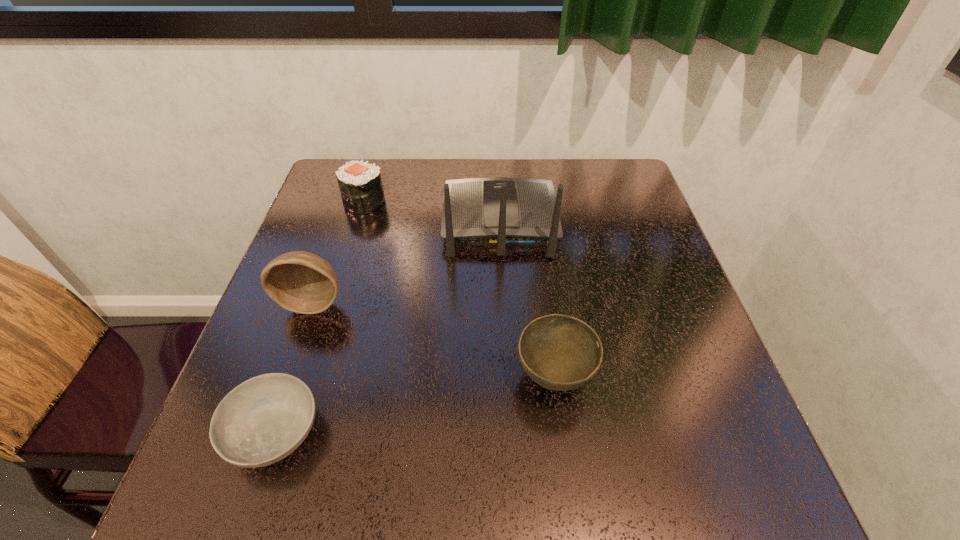
The width and height of the screenshot is (960, 540). I want to click on the tallest object, so click(498, 211).

The image size is (960, 540). Find the location of `the second tallest object`. the second tallest object is located at coordinates (302, 282).

Locate an element on the screen. The image size is (960, 540). the tallest bowl is located at coordinates (302, 282).

The width and height of the screenshot is (960, 540). What are the coordinates of `sushi` in the screenshot? It's located at (361, 187).

The height and width of the screenshot is (540, 960). In order to click on the rightmost bowl in this screenshot , I will do `click(559, 352)`.

Locate an element on the screen. The height and width of the screenshot is (540, 960). the shortest object is located at coordinates (263, 420).

Identify the location of vacant point located on the front-facing side of the router. (497, 169).

Identify the location of vacant space located on the front-facing side of the router. Image resolution: width=960 pixels, height=540 pixels. (497, 165).

Find the location of `vacant area situated 0.120m on the front-facing side of the router`. vacant area situated 0.120m on the front-facing side of the router is located at coordinates (497, 167).

Where is `vacant area situated on the back of the third nearest object`? Image resolution: width=960 pixels, height=540 pixels. vacant area situated on the back of the third nearest object is located at coordinates (331, 252).